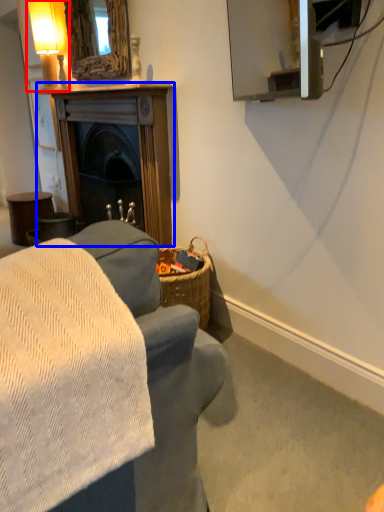
Question: Which object is further to the camera taking this photo, table lamp (highlighted by a red box) or fireplace (highlighted by a blue box)?

Choices:
 (A) table lamp
 (B) fireplace

Answer: (A)